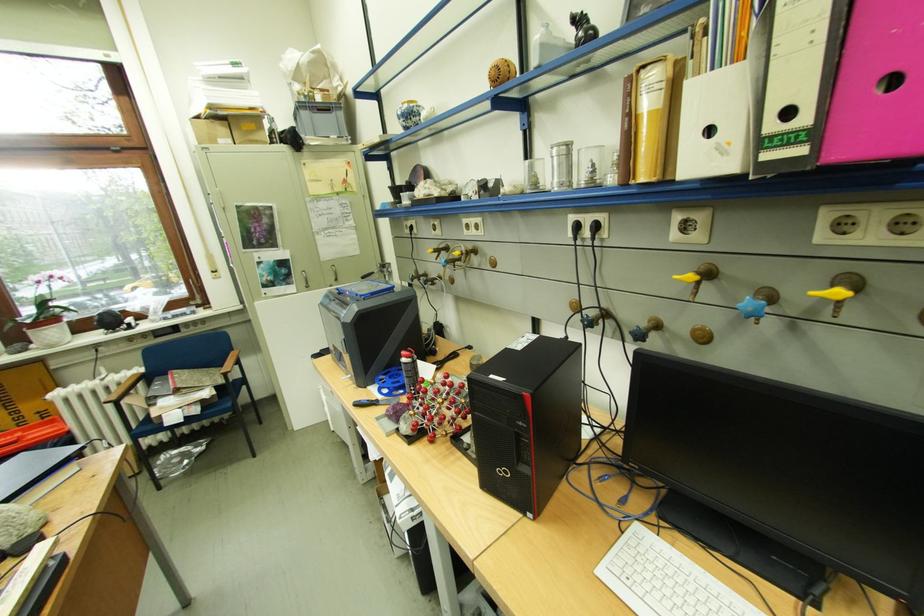
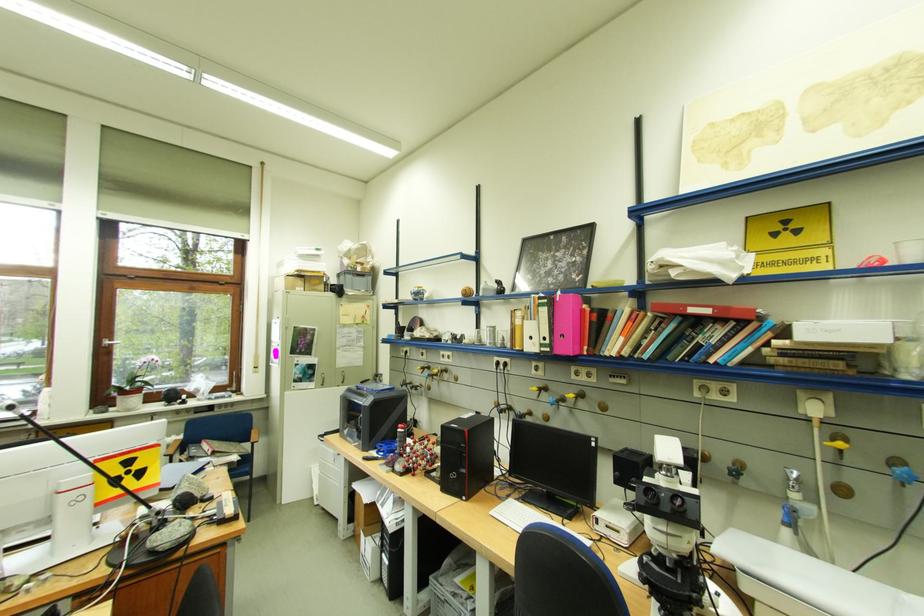
Locate, in the second image, the point that corresponds to (x=810, y=152) in the first image.

(558, 351)